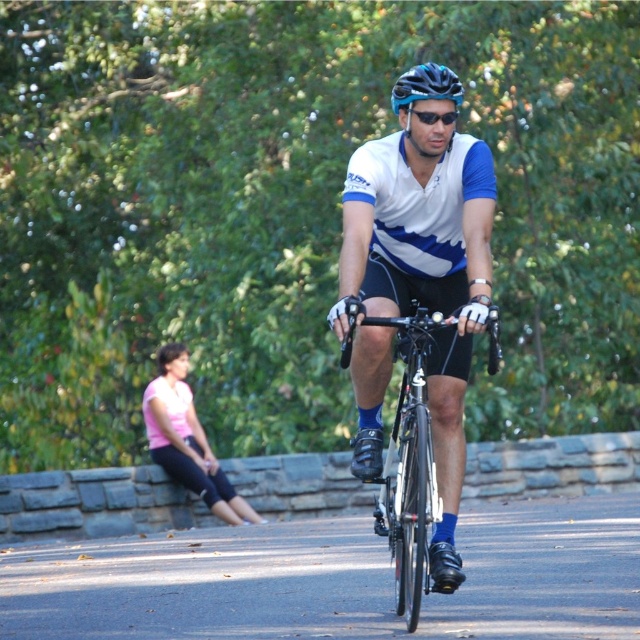
You are a photographer trying to capture a clear shot of both the pink fabric shirt at lower left and the matte blue bicycle helmet at center. Since you want both subjects in focus, which one should you adjust your camera focus on first to ensure both are sharp?

The matte blue bicycle helmet at center is behind the pink fabric shirt at lower left, so you should focus on the pink fabric shirt at lower left first to ensure both are in focus.

What object is located at the coordinates point (426, 84)?

The point (426, 84) is on the matte blue bicycle helmet at center.

You are a photographer trying to capture both the pink fabric shirt at lower left and the black matte sunglasses at center in a single frame. Based on their positions, which object should you adjust your camera focus to prioritize to ensure both are in the same focal plane?

The pink fabric shirt at lower left and the black matte sunglasses at center are at different distances from the camera. To ensure both are in focus, prioritize adjusting the focus on the object that is further away, which would be the pink fabric shirt at lower left since it is wider and likely closer to the camera compared to the sunglasses at center.